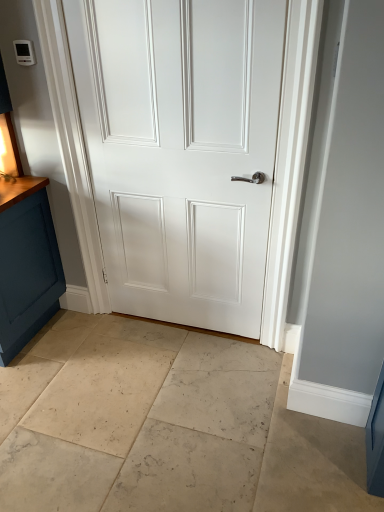
Question: Considering the positions of white matte door at center and beige marble floor at center in the image, is white matte door at center wider or thinner than beige marble floor at center?

Choices:
 (A) thin
 (B) wide

Answer: (A)

Question: Considering their positions, is white matte door at center located in front of or behind beige marble floor at center?

Choices:
 (A) behind
 (B) front

Answer: (A)

Question: From a real-world perspective, is white matte door at center positioned above or below beige marble floor at center?

Choices:
 (A) below
 (B) above

Answer: (B)

Question: From a real-world perspective, is beige marble floor at center physically located above or below white matte door at center?

Choices:
 (A) below
 (B) above

Answer: (A)

Question: Considering the positions of beige marble floor at center and white matte door at center in the image, is beige marble floor at center bigger or smaller than white matte door at center?

Choices:
 (A) small
 (B) big

Answer: (B)

Question: In terms of width, does beige marble floor at center look wider or thinner when compared to white matte door at center?

Choices:
 (A) wide
 (B) thin

Answer: (A)

Question: Is beige marble floor at center in front of or behind white matte door at center in the image?

Choices:
 (A) front
 (B) behind

Answer: (A)